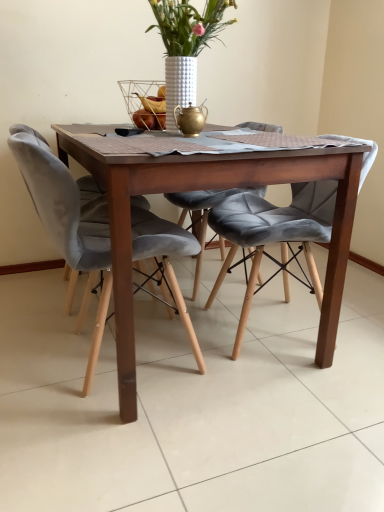
Question: Relative to velvet grey chair at center, the second chair positioned from the left, is velvet grey chair at left, the 1th chair in the left-to-right sequence, in front or behind?

Choices:
 (A) behind
 (B) front

Answer: (B)

Question: Is velvet grey chair at left, the 1th chair in the left-to-right sequence, wider or thinner than velvet grey chair at center, the first chair when ordered from right to left?

Choices:
 (A) thin
 (B) wide

Answer: (A)

Question: Based on their relative distances, which object is nearer to the velvet grey chair at center, the first chair when ordered from right to left?

Choices:
 (A) wooden table at center
 (B) white textured vase at upper center
 (C) velvet grey chair at left, the 2th chair from the right

Answer: (A)

Question: Estimate the real-world distances between objects in this image. Which object is closer to the white textured vase at upper center?

Choices:
 (A) wooden table at center
 (B) velvet grey chair at left, the 2th chair from the right
 (C) velvet grey chair at center, the first chair when ordered from right to left

Answer: (A)